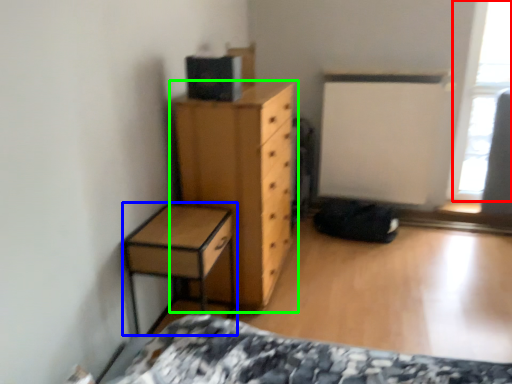
Question: Which object is positioned farthest from window screen (highlighted by a red box)? Select from nightstand (highlighted by a blue box) and chest of drawers (highlighted by a green box).

Choices:
 (A) nightstand
 (B) chest of drawers

Answer: (A)